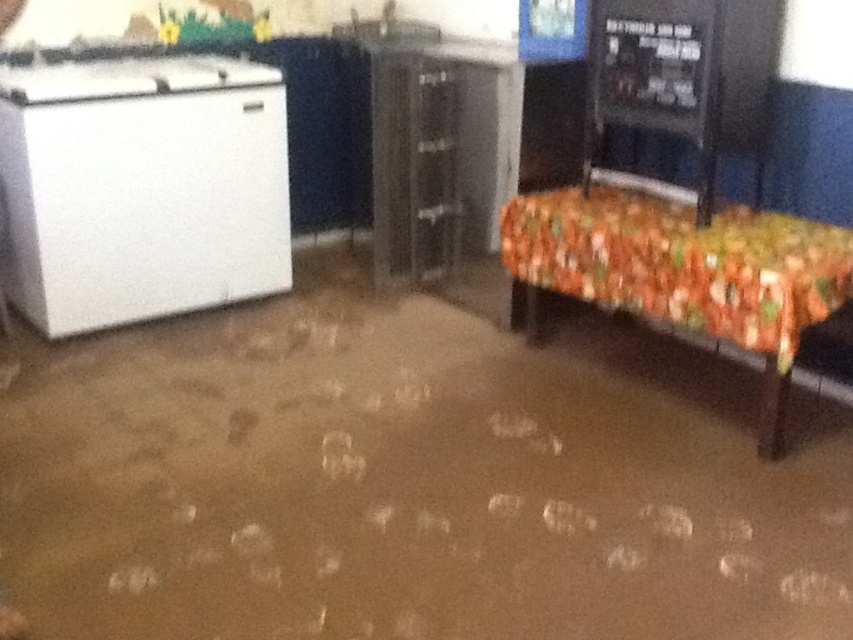
Is point (39, 204) positioned after point (581, 284)?

Yes, it is behind point (581, 284).

Between point (250, 157) and point (618, 228), which one is positioned in front?

Positioned in front is point (618, 228).

Is point (70, 106) less distant than point (693, 298)?

No.

Locate an element on the screen. white matte refrigerator at left is located at coordinates (142, 188).